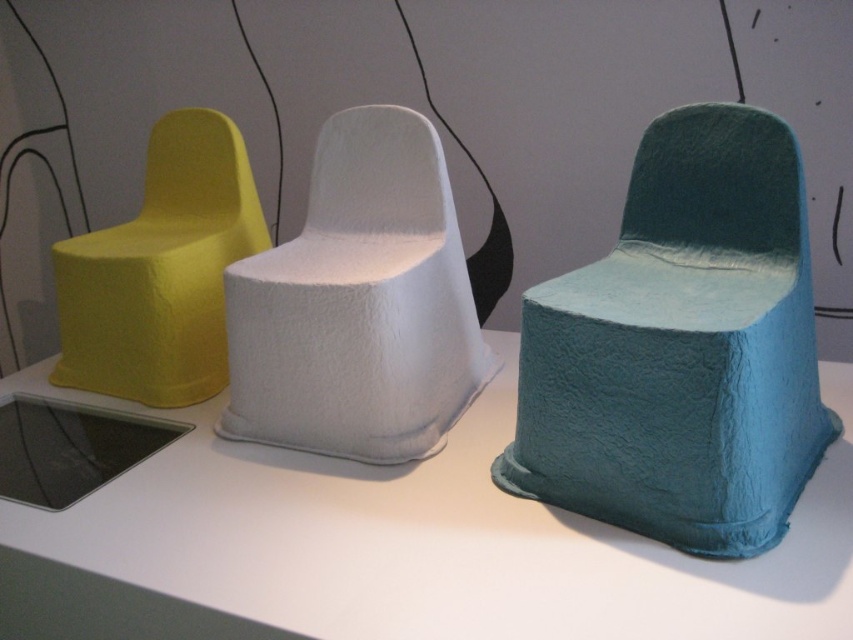
Question: Is white felt armchair at center to the right of matte yellow armchair at left from the viewer's perspective?

Choices:
 (A) yes
 (B) no

Answer: (A)

Question: Which object appears farthest from the camera in this image?

Choices:
 (A) teal felt armchair at center
 (B) matte yellow armchair at left

Answer: (B)

Question: Among these points, which one is nearest to the camera?

Choices:
 (A) (35, 532)
 (B) (346, 237)
 (C) (598, 436)

Answer: (C)

Question: Observing the image, what is the correct spatial positioning of white matte table at center in reference to matte yellow armchair at left?

Choices:
 (A) left
 (B) right

Answer: (B)

Question: Is teal felt armchair at center in front of matte yellow armchair at left?

Choices:
 (A) yes
 (B) no

Answer: (A)

Question: Which object is farther from the camera taking this photo?

Choices:
 (A) matte yellow armchair at left
 (B) white felt armchair at center

Answer: (A)